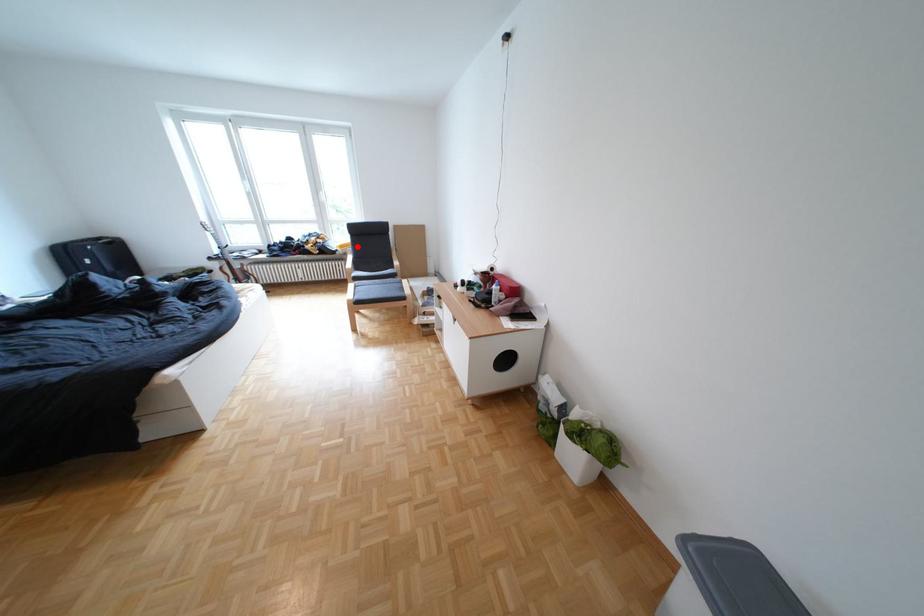
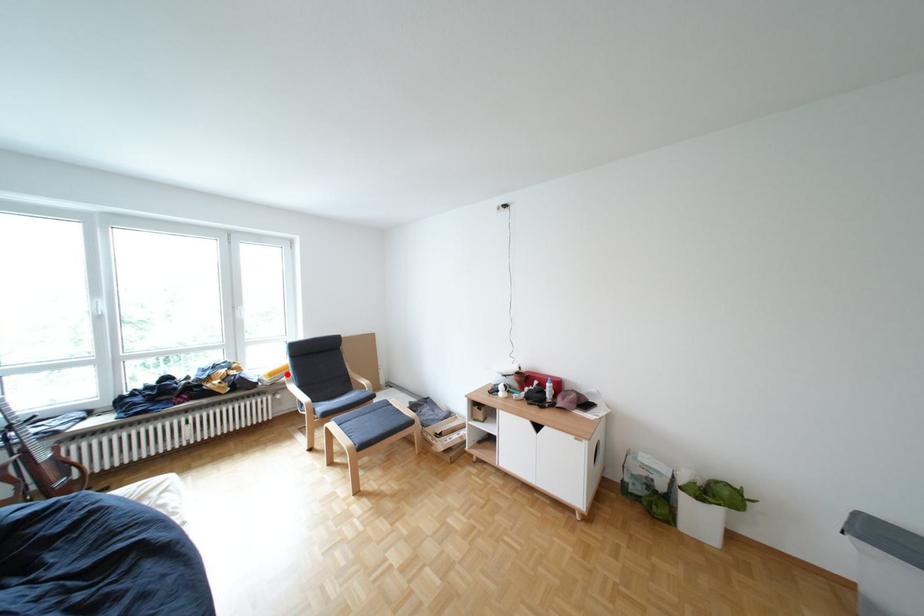
I am providing you with two images of the same scene from different viewpoints. A red point is marked on the first image and another point is marked on the second image. Does the point marked in image1 correspond to the same location as the one in image2?

Yes